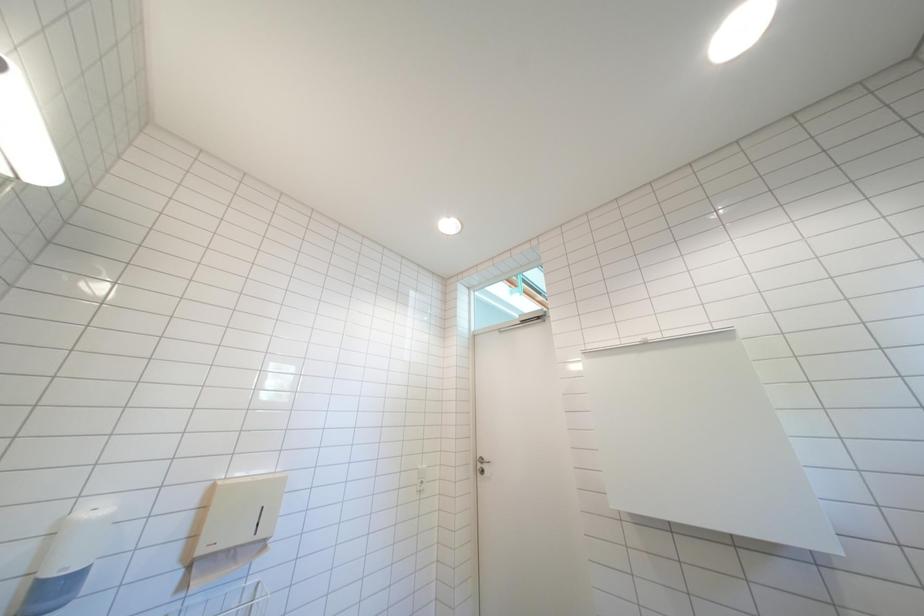
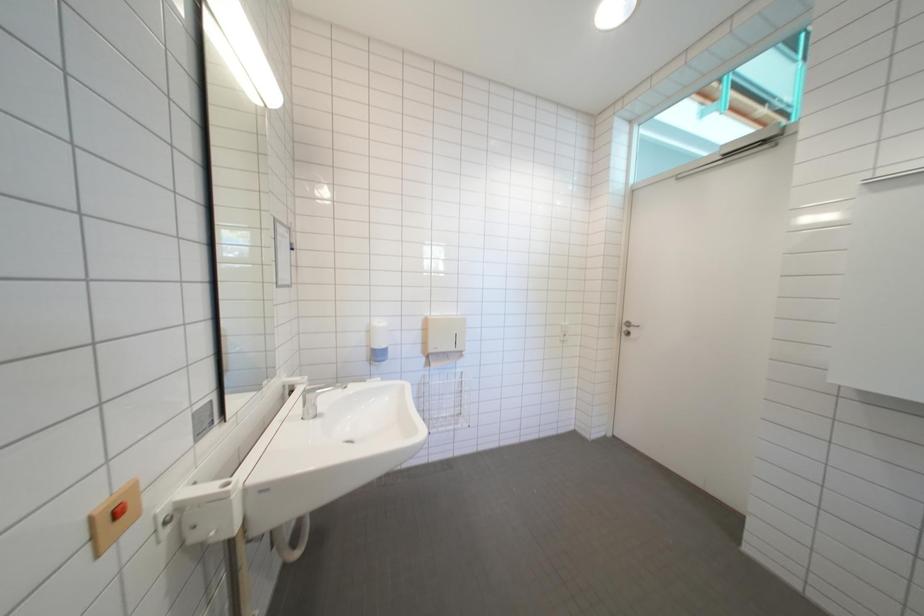
How did the camera likely rotate?

The rotation direction of the camera is left-down.